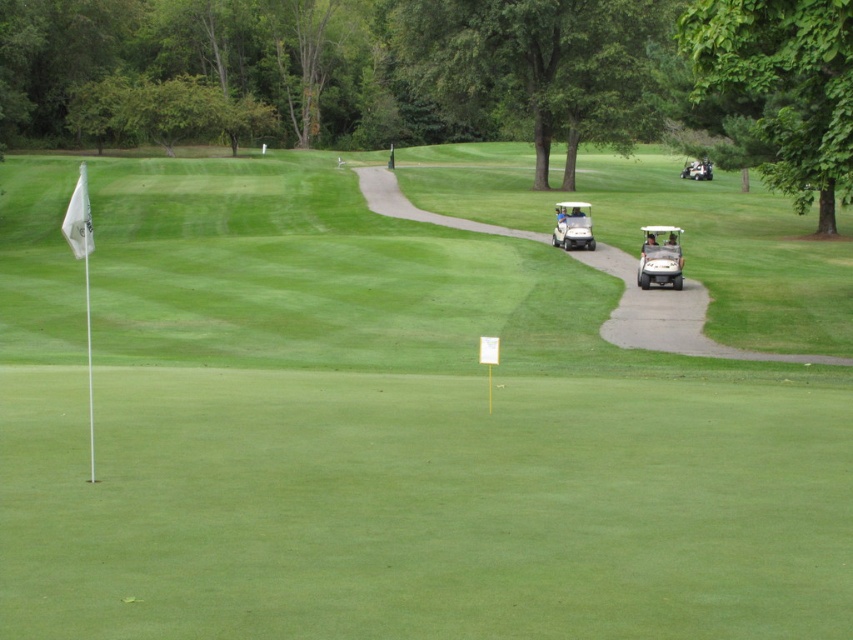
Question: Which point is farther from the camera taking this photo?

Choices:
 (A) (555, 211)
 (B) (653, 275)

Answer: (A)

Question: Which point appears farthest from the camera in this image?

Choices:
 (A) (642, 268)
 (B) (560, 230)

Answer: (B)

Question: Does matte white golf cart at right come behind white plastic golf cart at center?

Choices:
 (A) no
 (B) yes

Answer: (A)

Question: Does matte white golf cart at right have a greater width compared to white plastic golf cart at center?

Choices:
 (A) no
 (B) yes

Answer: (B)

Question: From the image, what is the correct spatial relationship of matte white golf cart at right in relation to white plastic golf cart at center?

Choices:
 (A) above
 (B) below

Answer: (B)